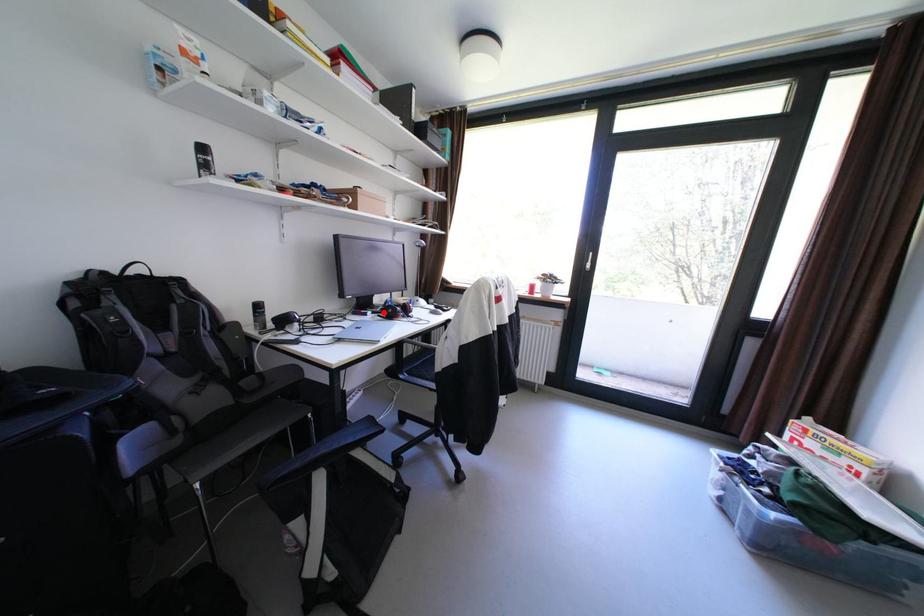
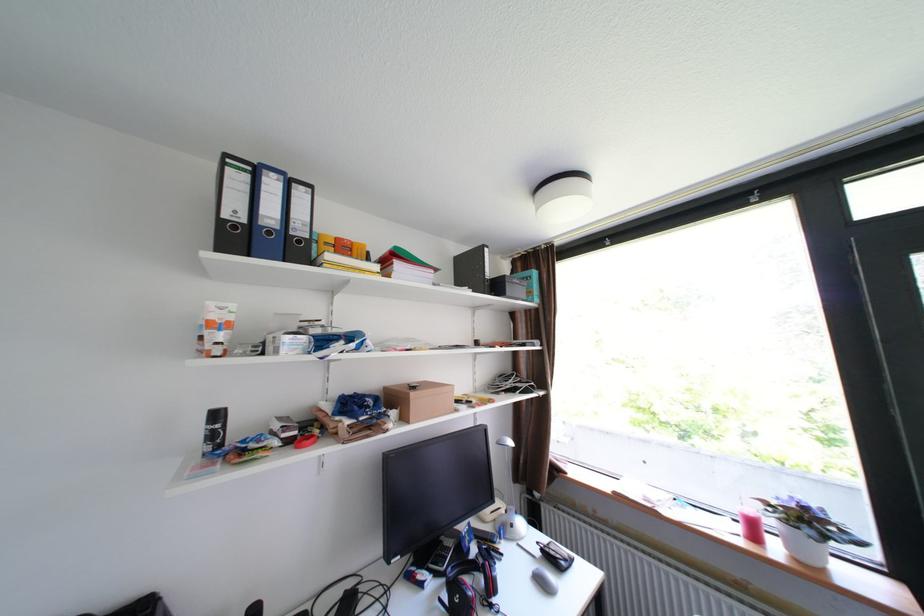
The point at the highlighted location is marked in the first image. Where is the corresponding point in the second image?

(446, 576)